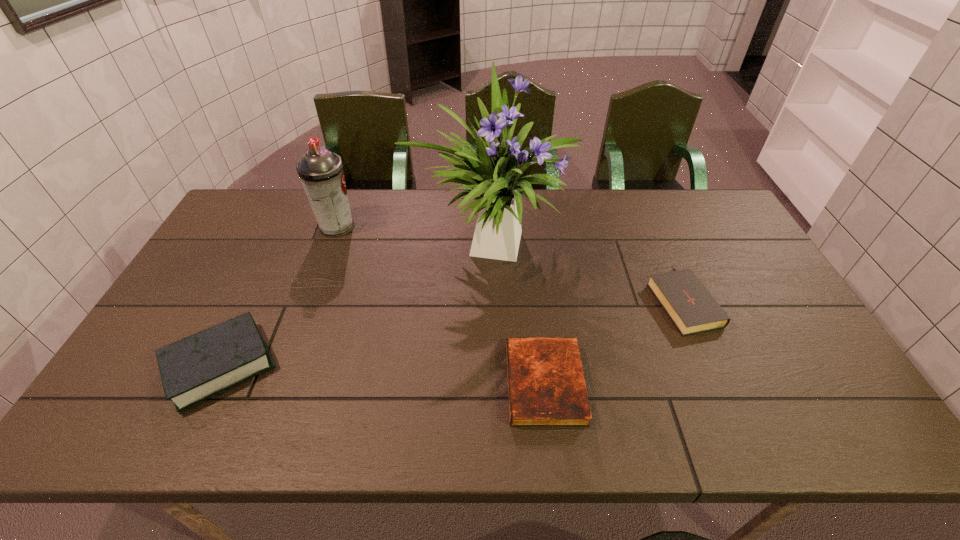
The width and height of the screenshot is (960, 540). In the image, there is a desktop. Identify the location of vacant space at the far left corner. (231, 219).

Identify the location of free space at the far right corner. (698, 221).

Find the location of `vacant point located between the second Bible from right to left and the second tallest object`. vacant point located between the second Bible from right to left and the second tallest object is located at coordinates point(441,305).

Find the location of a particular element. vacant space that's between the fourth shortest object and the second Bible from right to left is located at coordinates coord(441,305).

You are a GUI agent. You are given a task and a screenshot of the screen. Output one action in this format:
    pyautogui.click(x=<x>, y=<y>)
    Task: Click on the free space between the tallest object and the aerosol can
    Image resolution: width=960 pixels, height=540 pixels.
    Given the screenshot: What is the action you would take?
    pyautogui.click(x=414, y=235)

Where is `free spot between the second tallest object and the rightmost object`? free spot between the second tallest object and the rightmost object is located at coordinates (510, 263).

Where is `free space between the second Bible from left to right and the aerosol can`? The width and height of the screenshot is (960, 540). free space between the second Bible from left to right and the aerosol can is located at coordinates (441, 305).

Locate an element on the screen. This screenshot has width=960, height=540. free area in between the rightmost object and the leftmost Bible is located at coordinates (451, 332).

The width and height of the screenshot is (960, 540). I want to click on vacant space that is in between the rightmost Bible and the second Bible from right to left, so click(613, 342).

I want to click on vacant region between the leftmost Bible and the tallest object, so click(x=355, y=305).